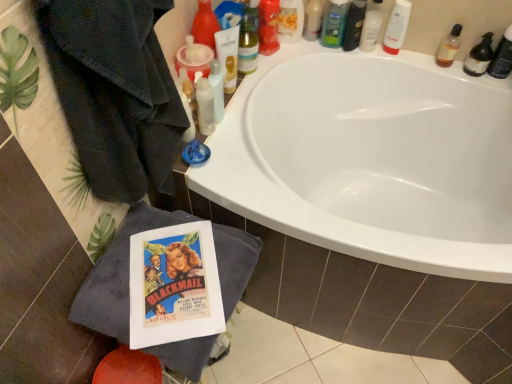
Question: Are shiny plastic bottle at upper center, acting as the eighth toiletry starting from the right, and green matte bottle at upper center, the 6th toiletry from the right, located far from each other?

Choices:
 (A) no
 (B) yes

Answer: (A)

Question: Can you confirm if shiny plastic bottle at upper center, acting as the eighth toiletry starting from the right, is smaller than green matte bottle at upper center, the 6th toiletry from the right?

Choices:
 (A) yes
 (B) no

Answer: (B)

Question: Considering the relative sizes of shiny plastic bottle at upper center, acting as the eighth toiletry starting from the right, and green matte bottle at upper center, positioned as the fourth toiletry in left-to-right order, in the image provided, is shiny plastic bottle at upper center, acting as the eighth toiletry starting from the right, taller than green matte bottle at upper center, positioned as the fourth toiletry in left-to-right order,?

Choices:
 (A) no
 (B) yes

Answer: (B)

Question: Does shiny plastic bottle at upper center, the 2th toiletry from the left, come behind green matte bottle at upper center, the 6th toiletry from the right?

Choices:
 (A) no
 (B) yes

Answer: (A)

Question: Are shiny plastic bottle at upper center, acting as the eighth toiletry starting from the right, and green matte bottle at upper center, positioned as the fourth toiletry in left-to-right order, beside each other?

Choices:
 (A) yes
 (B) no

Answer: (B)

Question: Is shiny plastic bottle at upper center, acting as the eighth toiletry starting from the right, to the right of green matte bottle at upper center, the 6th toiletry from the right, from the viewer's perspective?

Choices:
 (A) no
 (B) yes

Answer: (A)

Question: From a real-world perspective, is translucent plastic bottle at upper right, arranged as the 8th toiletry when viewed from the left, physically below translucent plastic tube at upper center, the second mouthwash viewed from the right?

Choices:
 (A) no
 (B) yes

Answer: (B)

Question: Can you confirm if translucent plastic bottle at upper right, arranged as the 8th toiletry when viewed from the left, is wider than translucent plastic tube at upper center, which is the first mouthwash from left to right?

Choices:
 (A) no
 (B) yes

Answer: (A)

Question: Can you confirm if translucent plastic bottle at upper right, which ranks as the 2th toiletry in right-to-left order, is positioned to the right of translucent plastic tube at upper center, which is the first mouthwash from left to right?

Choices:
 (A) yes
 (B) no

Answer: (A)

Question: Is the surface of translucent plastic bottle at upper right, arranged as the 8th toiletry when viewed from the left, in direct contact with translucent plastic tube at upper center, the second mouthwash viewed from the right?

Choices:
 (A) yes
 (B) no

Answer: (B)

Question: Is translucent plastic tube at upper center, which is the first mouthwash from left to right, at the back of translucent plastic bottle at upper right, which ranks as the 2th toiletry in right-to-left order?

Choices:
 (A) no
 (B) yes

Answer: (A)

Question: Is translucent plastic bottle at upper right, which ranks as the 2th toiletry in right-to-left order, closer to camera compared to translucent plastic tube at upper center, the second mouthwash viewed from the right?

Choices:
 (A) no
 (B) yes

Answer: (A)

Question: Is translucent plastic bottle at upper right, the 1th toiletry in the right-to-left sequence, at the left side of white plastic tube at upper right, which is the fourth toiletry in right-to-left order?

Choices:
 (A) yes
 (B) no

Answer: (B)